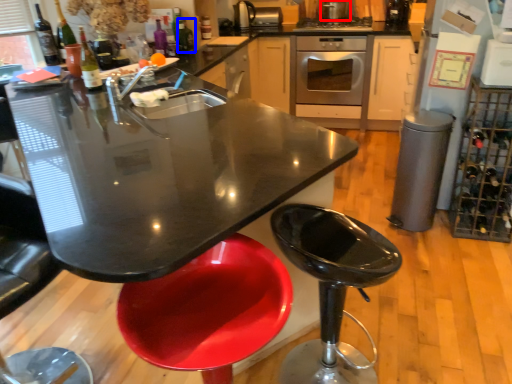
Question: Which object is further to the camera taking this photo, appliance (highlighted by a red box) or wine bottle (highlighted by a blue box)?

Choices:
 (A) appliance
 (B) wine bottle

Answer: (A)